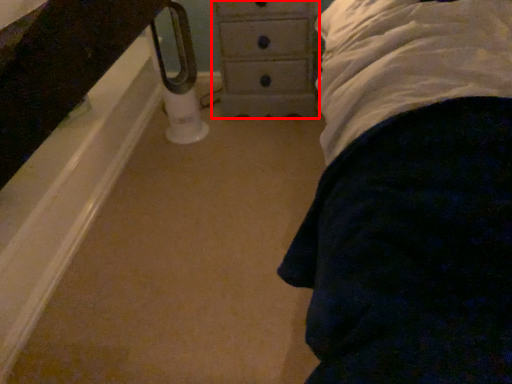
Question: Where is chest of drawers (annotated by the red box) located in relation to towel bar in the image?

Choices:
 (A) right
 (B) left

Answer: (A)